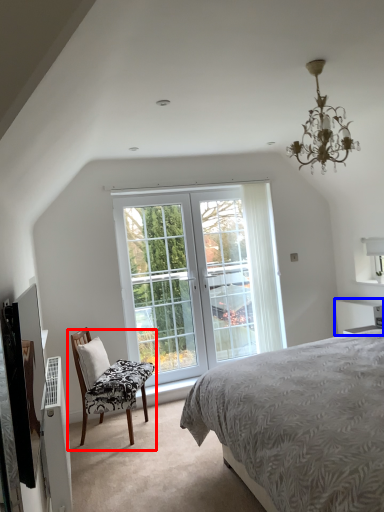
Question: Which object appears closest to the camera in this image, chair (highlighted by a red box) or vanity (highlighted by a blue box)?

Choices:
 (A) chair
 (B) vanity

Answer: (A)